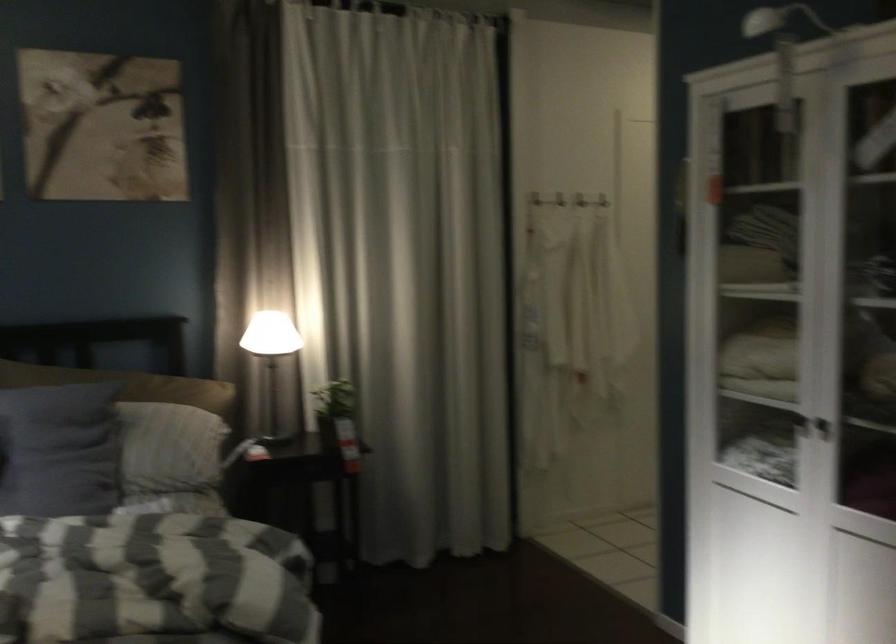
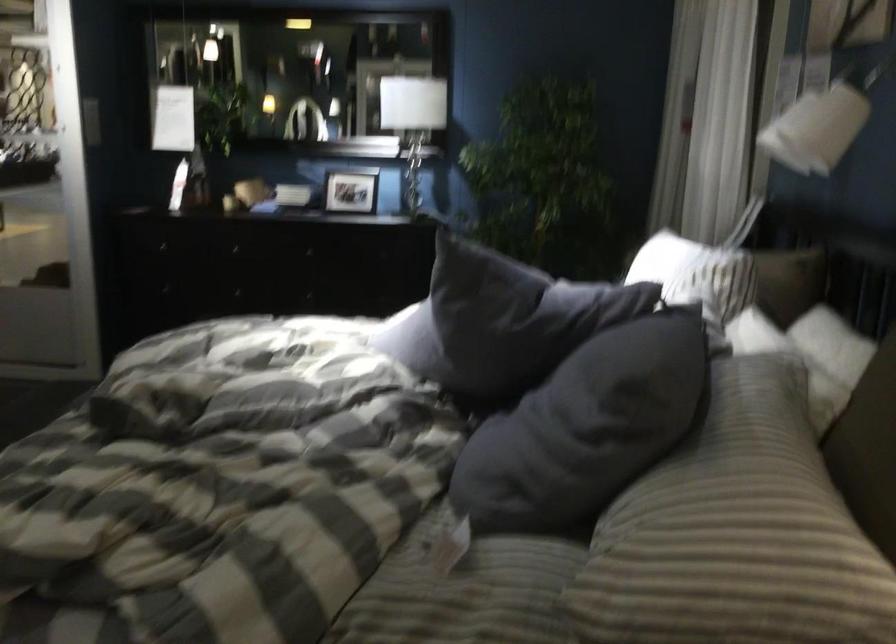
Locate, in the second image, the point that corresponds to pixel 142 410 in the first image.

(760, 453)